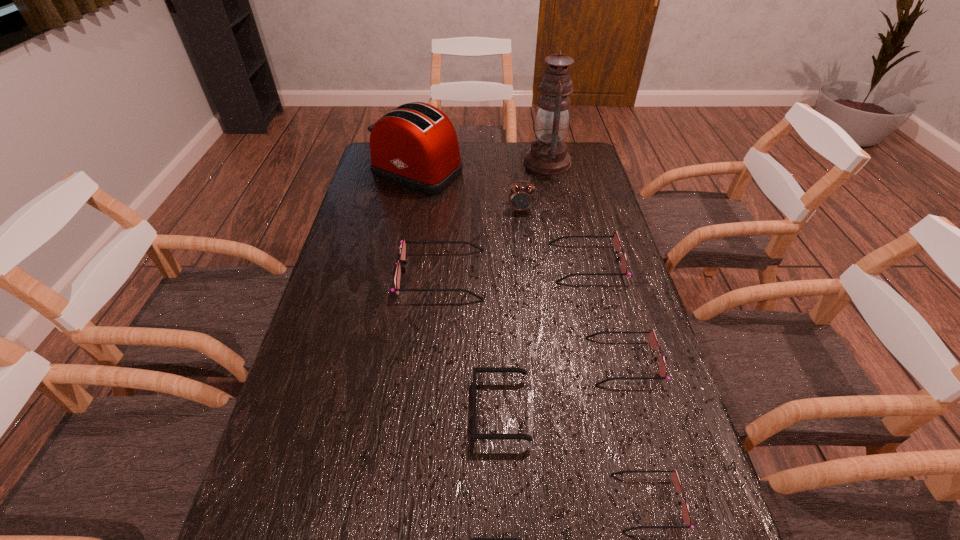
Select which pink sunglasses appears as the closest to the second biggest pink sunglasses. Please provide its 2D coordinates. Your answer should be formatted as a tuple, i.e. [(x, y)], where the tuple contains the x and y coordinates of a point satisfying the conditions above.

[(652, 339)]

You are a GUI agent. You are given a task and a screenshot of the screen. Output one action in this format:
    pyautogui.click(x=<x>, y=<y>)
    Task: Click on the pink sunglasses object that ranks as the third closest to the smaller black sunglasses
    The height and width of the screenshot is (540, 960).
    Given the screenshot: What is the action you would take?
    pyautogui.click(x=403, y=242)

Where is `free space that satisfies the following two spatial constraints: 1. on the face of the alarm clock; 2. on the bridge of the sixth shortest object`? This screenshot has height=540, width=960. free space that satisfies the following two spatial constraints: 1. on the face of the alarm clock; 2. on the bridge of the sixth shortest object is located at coordinates (527, 274).

Locate an element on the screen. The image size is (960, 540). free space that satisfies the following two spatial constraints: 1. on the back side of the tallest object; 2. on the right side of the eighth shortest object is located at coordinates (420, 163).